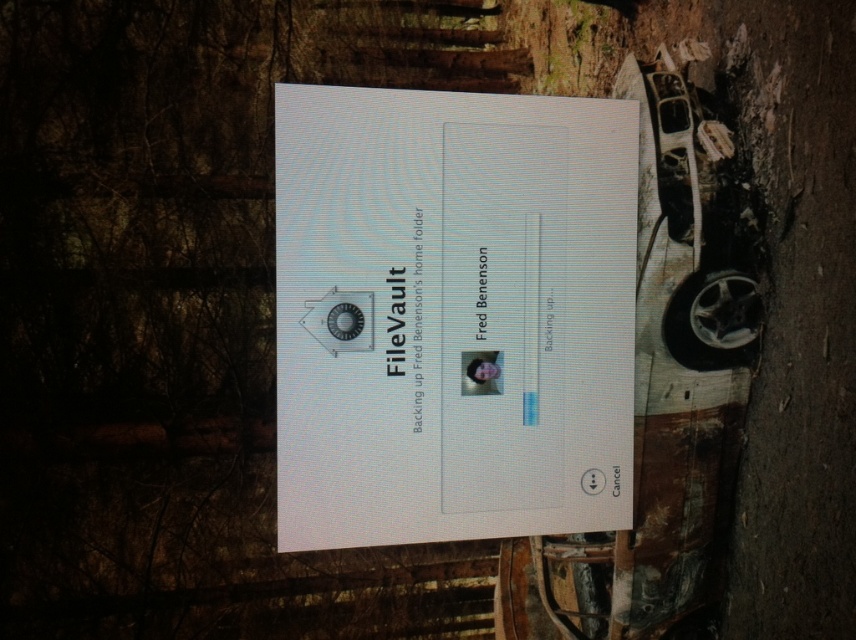
You are a delivery robot with a height of 1.6 meters. You are approaching the white glossy paper at center. Can you safely pass under it without hitting your head?

The white glossy paper at center is 1.71 meters away from the camera. Since your height is 1.6 meters, which is less than the distance, you can safely pass under it without hitting your head.

What are the coordinates of the white glossy paper at center?

The white glossy paper at center is located at point (452,314).